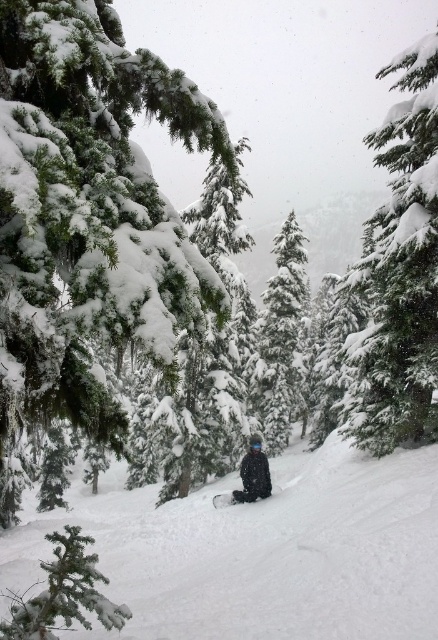
Looking at this image, who is positioned more to the right, snow-covered evergreen tree at center or snow-covered pine tree at lower left?

From the viewer's perspective, snow-covered evergreen tree at center appears more on the right side.

Who is shorter, snow-covered evergreen tree at center or snow-covered pine tree at lower left?

With less height is snow-covered pine tree at lower left.

This screenshot has width=438, height=640. Describe the element at coordinates (281, 339) in the screenshot. I see `snow-covered evergreen tree at center` at that location.

Locate an element on the screen. snow-covered evergreen tree at center is located at coordinates [281, 339].

Does point (336, 508) lie behind point (229, 497)?

No, it is not.

Is white snowboard at center below black matte snowboard at center?

Yes, white snowboard at center is below black matte snowboard at center.

Describe the element at coordinates (261, 552) in the screenshot. I see `white snowboard at center` at that location.

Locate an element on the screen. white snowboard at center is located at coordinates (261, 552).

Who is more distant from viewer, (207, 588) or (10, 616)?

Point (207, 588)

Is white snowboard at center above snow-covered pine tree at lower left?

No, white snowboard at center is not above snow-covered pine tree at lower left.

Where is `white snowboard at center`? The image size is (438, 640). white snowboard at center is located at coordinates (261, 552).